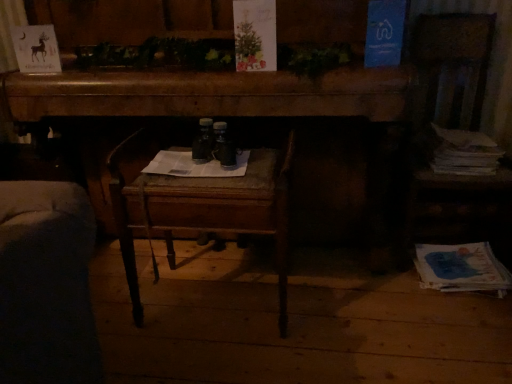
You are a GUI agent. You are given a task and a screenshot of the screen. Output one action in this format:
    pyautogui.click(x=<x>, y=<y>)
    Task: Click on the free area behind wooden chair at center
    This screenshot has width=512, height=384.
    Given the screenshot: What is the action you would take?
    pyautogui.click(x=221, y=254)